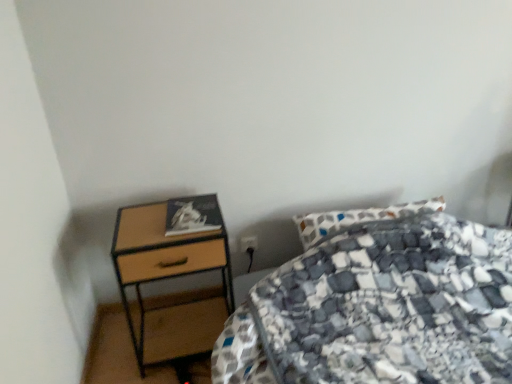
What is the approximate width of black plastic power plug at lower center?

0.77 inches.

What do you see at coordinates (169, 278) in the screenshot? The height and width of the screenshot is (384, 512). I see `woodenmaterial/texturenightstand at left` at bounding box center [169, 278].

Describe the element at coordinates (378, 304) in the screenshot. I see `patterned fabric bed at center` at that location.

Where is `black plastic power plug at lower center`? The image size is (512, 384). black plastic power plug at lower center is located at coordinates (x=248, y=243).

Is woodenmaterial/texturenightstand at left far from patterned fabric bed at center?

woodenmaterial/texturenightstand at left is near patterned fabric bed at center, not far away.

Which of these two, woodenmaterial/texturenightstand at left or patterned fabric bed at center, stands taller?

woodenmaterial/texturenightstand at left is taller.

Which object is positioned more to the left, woodenmaterial/texturenightstand at left or patterned fabric bed at center?

From the viewer's perspective, woodenmaterial/texturenightstand at left appears more on the left side.

From the image's perspective, which object appears higher, woodenmaterial/texturenightstand at left or patterned fabric bed at center?

woodenmaterial/texturenightstand at left.

Can black plastic power plug at lower center be found inside woodenmaterial/texturenightstand at left?

Definitely not — black plastic power plug at lower center is not inside woodenmaterial/texturenightstand at left.

What's the angular difference between woodenmaterial/texturenightstand at left and black plastic power plug at lower center's facing directions?

0.00773 degrees separate the facing orientations of woodenmaterial/texturenightstand at left and black plastic power plug at lower center.

Is woodenmaterial/texturenightstand at left closer to the viewer compared to black plastic power plug at lower center?

Yes, the depth of woodenmaterial/texturenightstand at left is less than that of black plastic power plug at lower center.

Is point (156, 217) positioned in front of point (251, 242)?

Yes, point (156, 217) is closer to viewer.

From a real-world perspective, is patterned fabric bed at center beneath woodenmaterial/texturenightstand at left?

Indeed, from a real-world perspective, patterned fabric bed at center is positioned beneath woodenmaterial/texturenightstand at left.

Which object is positioned more to the left, patterned fabric bed at center or woodenmaterial/texturenightstand at left?

woodenmaterial/texturenightstand at left is more to the left.

Is woodenmaterial/texturenightstand at left a part of patterned fabric bed at center?

No, woodenmaterial/texturenightstand at left is not inside patterned fabric bed at center.

The height and width of the screenshot is (384, 512). I want to click on nightstand lying behind the patterned fabric bed at center, so click(x=169, y=278).

Is black plastic power plug at lower center aimed at patterned fabric bed at center?

Yes.

Considering the relative sizes of black plastic power plug at lower center and patterned fabric bed at center in the image provided, is black plastic power plug at lower center smaller than patterned fabric bed at center?

Yes, black plastic power plug at lower center is smaller than patterned fabric bed at center.

Based on the photo, considering the sizes of objects black plastic power plug at lower center and patterned fabric bed at center in the image provided, who is taller, black plastic power plug at lower center or patterned fabric bed at center?

Standing taller between the two is patterned fabric bed at center.

From the picture: From the image's perspective, is black plastic power plug at lower center beneath patterned fabric bed at center?

No.

Does point (470, 235) appear closer or farther from the camera than point (256, 239)?

Point (470, 235).

How different are the orientations of patterned fabric bed at center and black plastic power plug at lower center in degrees?

1.71 degrees.

Considering the relative sizes of patterned fabric bed at center and black plastic power plug at lower center in the image provided, is patterned fabric bed at center taller than black plastic power plug at lower center?

Indeed, patterned fabric bed at center has a greater height compared to black plastic power plug at lower center.

Would you consider patterned fabric bed at center to be distant from black plastic power plug at lower center?

No, patterned fabric bed at center is not far from black plastic power plug at lower center.

Identify the location of nightstand that is on the left side of black plastic power plug at lower center. (169, 278).

From the image's perspective, which object appears higher, black plastic power plug at lower center or woodenmaterial/texturenightstand at left?

black plastic power plug at lower center is shown above in the image.

Are black plastic power plug at lower center and woodenmaterial/texturenightstand at left located far from each other?

black plastic power plug at lower center is near woodenmaterial/texturenightstand at left, not far away.

Does black plastic power plug at lower center contain woodenmaterial/texturenightstand at left?

Definitely not — woodenmaterial/texturenightstand at left is not inside black plastic power plug at lower center.

The image size is (512, 384). I want to click on bed lying below the woodenmaterial/texturenightstand at left (from the image's perspective), so click(x=378, y=304).

This screenshot has width=512, height=384. I want to click on nightstand on the left of black plastic power plug at lower center, so click(x=169, y=278).

Estimate the real-world distances between objects in this image. Which object is further from black plastic power plug at lower center, woodenmaterial/texturenightstand at left or patterned fabric bed at center?

Among the two, patterned fabric bed at center is located further to black plastic power plug at lower center.

Which object lies further to the anchor point patterned fabric bed at center, woodenmaterial/texturenightstand at left or black plastic power plug at lower center?

black plastic power plug at lower center.

Which object lies nearer to the anchor point woodenmaterial/texturenightstand at left, patterned fabric bed at center or black plastic power plug at lower center?

Based on the image, black plastic power plug at lower center appears to be nearer to woodenmaterial/texturenightstand at left.

When comparing their distances from patterned fabric bed at center, does black plastic power plug at lower center or woodenmaterial/texturenightstand at left seem further?

black plastic power plug at lower center.

Which object lies further to the anchor point woodenmaterial/texturenightstand at left, black plastic power plug at lower center or patterned fabric bed at center?

Based on the image, patterned fabric bed at center appears to be further to woodenmaterial/texturenightstand at left.

From the image, which object appears to be nearer to black plastic power plug at lower center, patterned fabric bed at center or woodenmaterial/texturenightstand at left?

woodenmaterial/texturenightstand at left.

Find the location of a particular element. The height and width of the screenshot is (384, 512). nightstand located between patterned fabric bed at center and black plastic power plug at lower center in the depth direction is located at coordinates (169, 278).